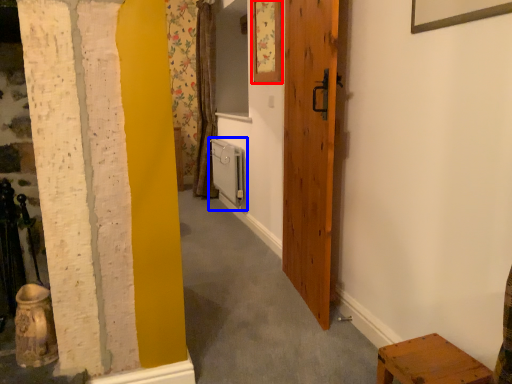
Question: Which point is further to the camera, picture frame (highlighted by a red box) or radiator (highlighted by a blue box)?

Choices:
 (A) picture frame
 (B) radiator

Answer: (B)